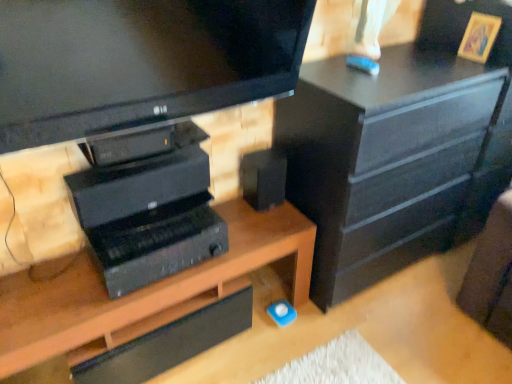
Question: Is black matte speaker at center taller than wooden desk at center?

Choices:
 (A) no
 (B) yes

Answer: (A)

Question: Is black matte speaker at center not near wooden desk at center?

Choices:
 (A) no
 (B) yes

Answer: (A)

Question: Does black matte speaker at center have a lesser height compared to wooden desk at center?

Choices:
 (A) yes
 (B) no

Answer: (A)

Question: Is wooden desk at center at the back of black matte speaker at center?

Choices:
 (A) no
 (B) yes

Answer: (A)

Question: Can you confirm if black matte speaker at center is wider than wooden desk at center?

Choices:
 (A) yes
 (B) no

Answer: (B)

Question: Is black matte speaker at center located outside wooden desk at center?

Choices:
 (A) yes
 (B) no

Answer: (A)

Question: Does black matte chest of drawers at upper right have a greater width compared to black matte speaker at center?

Choices:
 (A) no
 (B) yes

Answer: (B)

Question: Is black matte chest of drawers at upper right to the right of black matte speaker at center from the viewer's perspective?

Choices:
 (A) no
 (B) yes

Answer: (B)

Question: Considering the relative sizes of black matte chest of drawers at upper right and black matte speaker at center in the image provided, is black matte chest of drawers at upper right taller than black matte speaker at center?

Choices:
 (A) no
 (B) yes

Answer: (B)

Question: From the image's perspective, is black matte chest of drawers at upper right under black matte speaker at center?

Choices:
 (A) yes
 (B) no

Answer: (B)

Question: Is black matte chest of drawers at upper right facing away from black matte speaker at center?

Choices:
 (A) no
 (B) yes

Answer: (A)

Question: Is black matte chest of drawers at upper right thinner than black matte speaker at center?

Choices:
 (A) yes
 (B) no

Answer: (B)

Question: Does black plastic computer at center appear on the right side of black matte speaker at center?

Choices:
 (A) no
 (B) yes

Answer: (A)